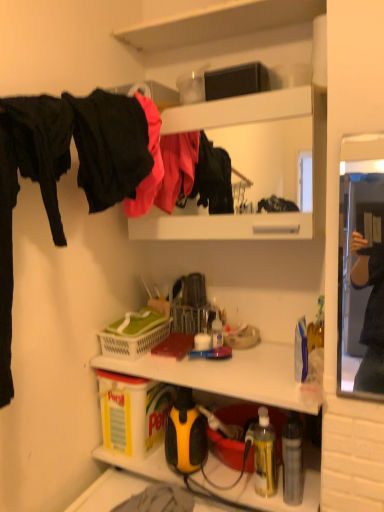
I want to click on vacant region to the left of metallic silver bottle at lower right, the second bottle viewed from the left, so click(x=238, y=490).